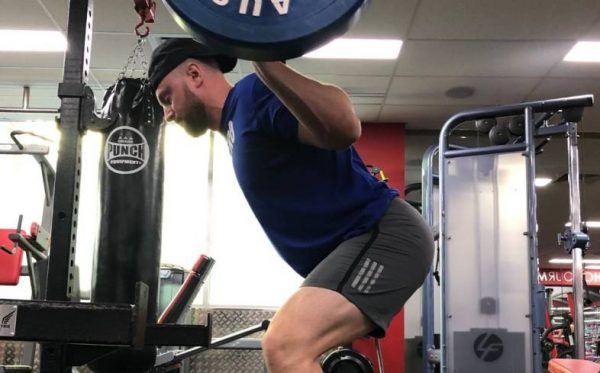
Where is `white letters on wall`? The width and height of the screenshot is (600, 373). white letters on wall is located at coordinates (557, 279).